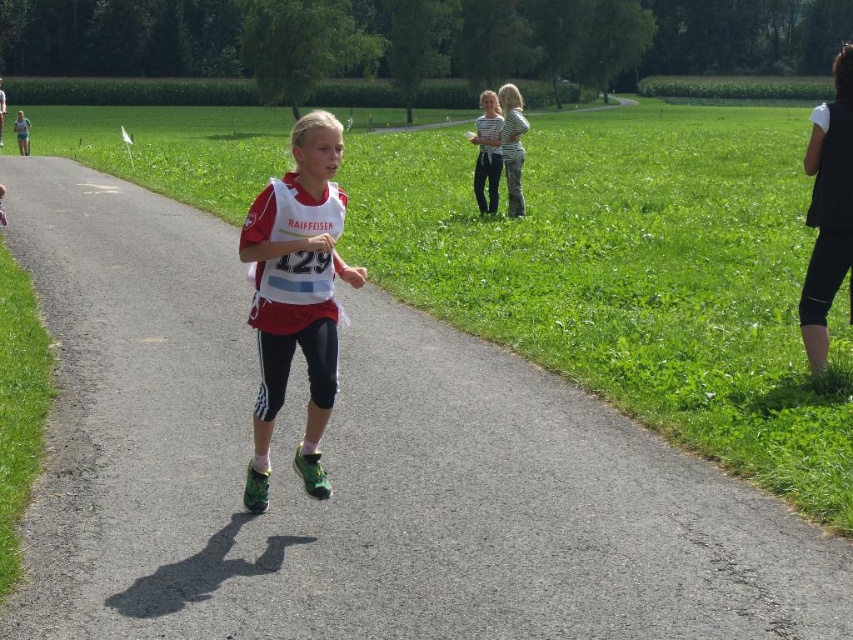
You are a photographer standing at the starting line of the race. You want to capture a photo of the point at coordinates point [254,300]. If your camera can focus on objects within 5 meters, will you be able to focus on that point?

The distance of point [254,300] from camera is 5.53 meters, so the camera cannot focus on that point since it is beyond the 5 meters range.

Consider the image. You are a photographer positioned at the starting line of the race. You want to take a photo that includes both the point at coordinates point (299,320) and point (482,204). Which point should you focus on first to ensure both are in sharp focus?

You should focus on point (299,320) first because it is closer to the viewer, and focusing on the closer point will naturally bring the farther point into focus as well.

Looking at this image, you are a photographer at the race event. You want to capture a photo that includes both the black matte vest at right and the striped fabric shirt at upper center. Which object should you focus on first to ensure both are in frame?

You should focus on the black matte vest at right first since it is larger than the striped fabric shirt at upper center, allowing you to frame both objects effectively.